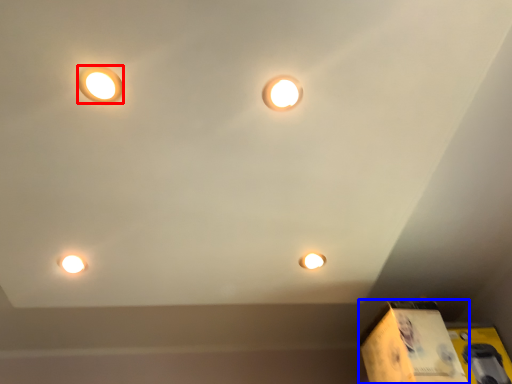
Question: Among these objects, which one is nearest to the camera, lamp (highlighted by a red box) or cardboard box (highlighted by a blue box)?

Choices:
 (A) lamp
 (B) cardboard box

Answer: (A)